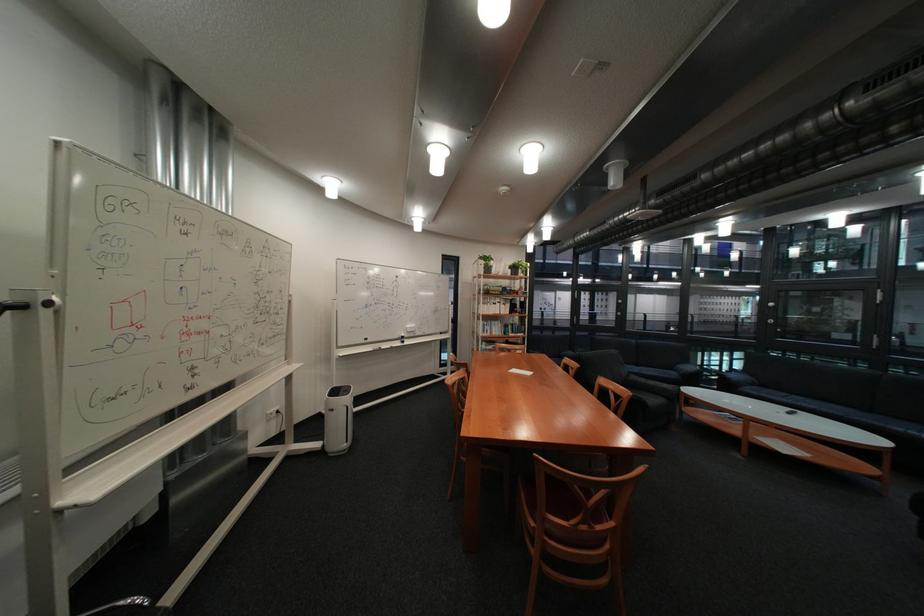
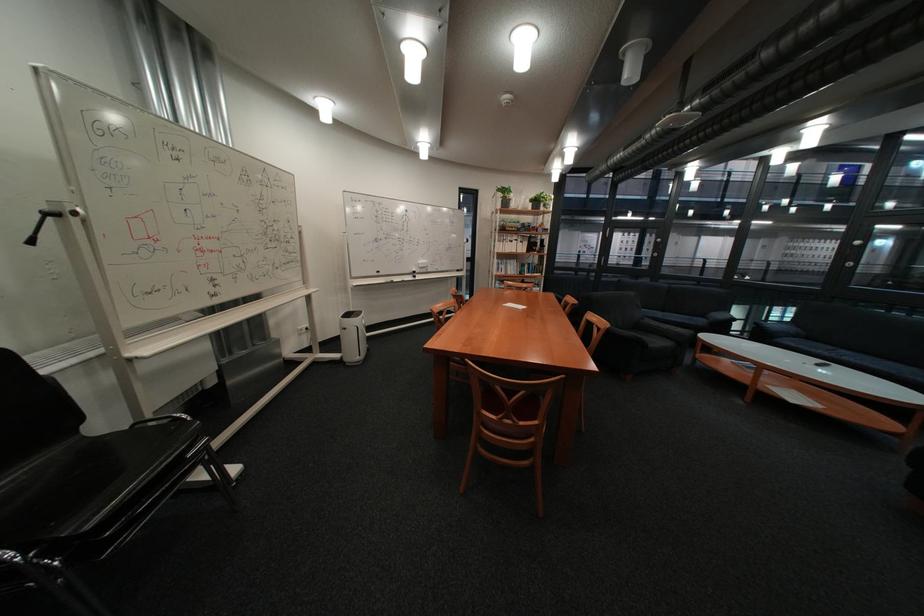
Where in the second image is the point corresponding to [614,385] from the first image?

(602, 320)